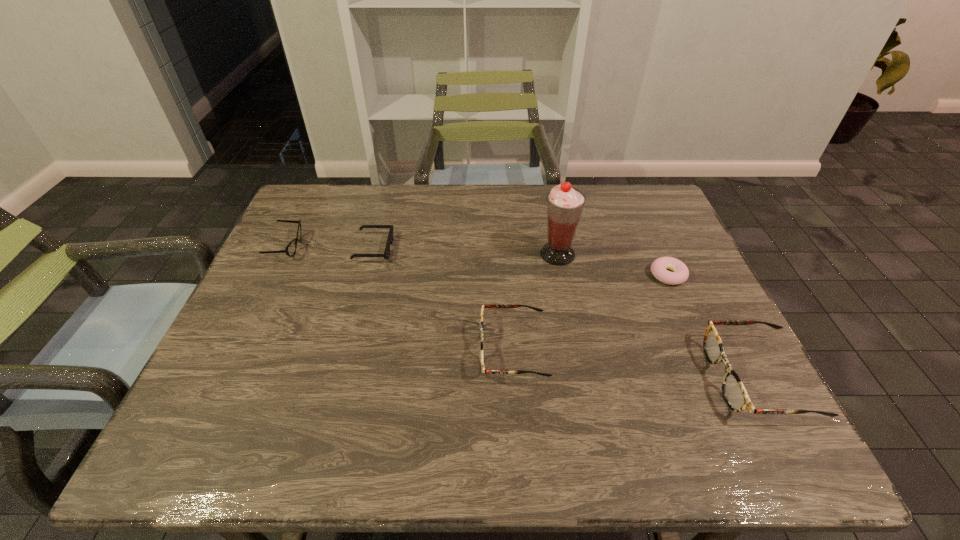
Please point a free position for a spectacles on the left. Please provide its 2D coordinates. Your answer should be formatted as a tuple, i.e. [(x, y)], where the tuple contains the x and y coordinates of a point satisfying the conditions above.

[(295, 324)]